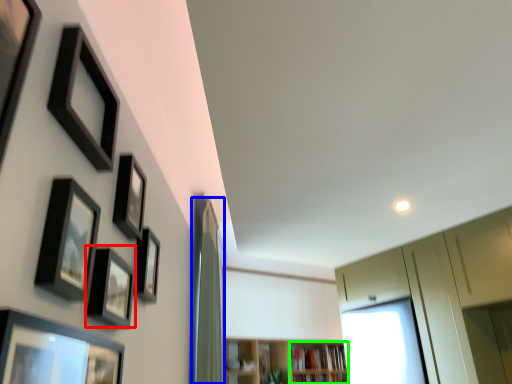
Question: Which object is positioned closest to picture frame (highlighted by a red box)? Select from curtain (highlighted by a blue box) and shelf (highlighted by a green box).

Choices:
 (A) curtain
 (B) shelf

Answer: (A)